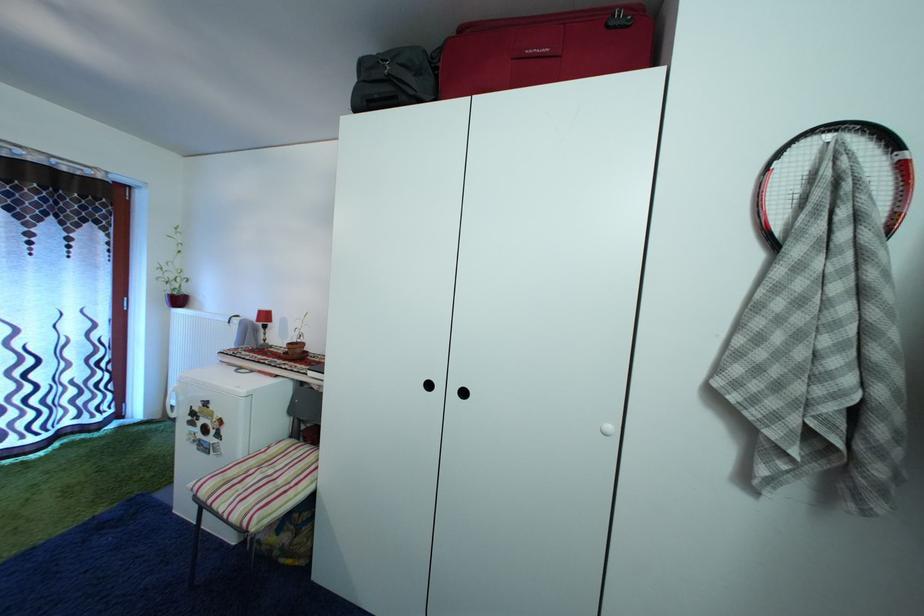
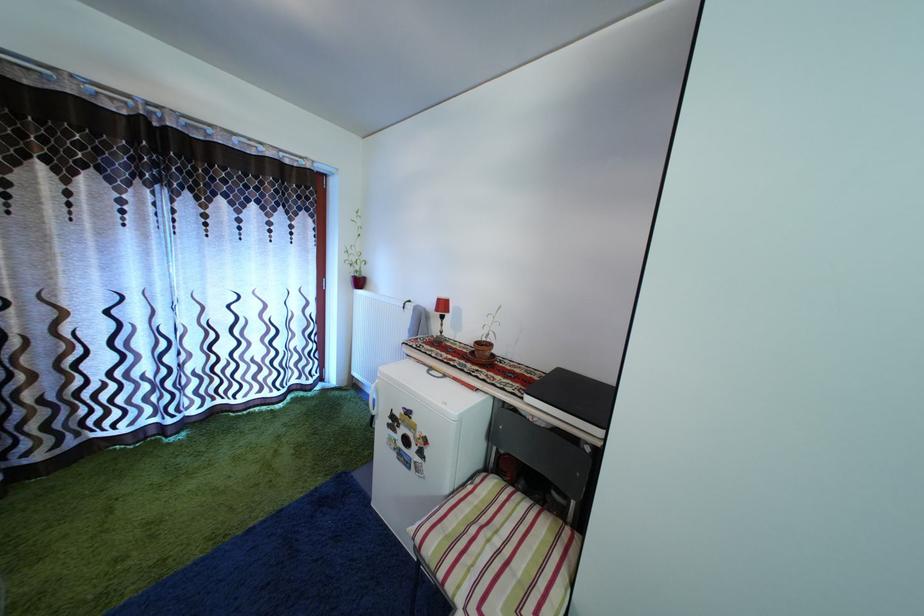
Where in the second image is the point corresponding to point (298, 351) from the first image?

(485, 350)